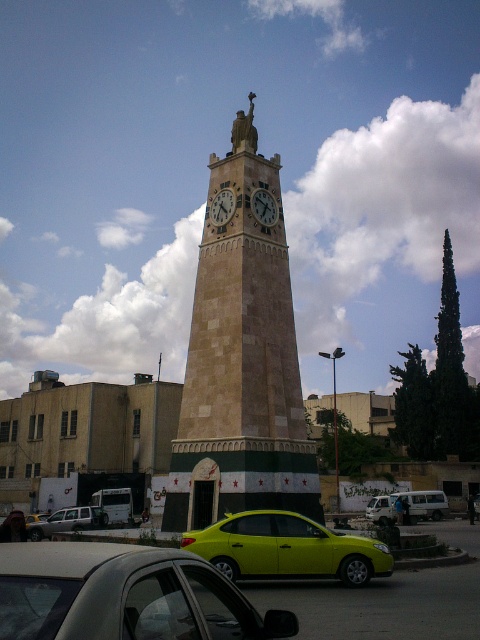
You are standing in the urban area and see the beige stone clock tower at center and the stone clock at center. Which one is closer to you?

The beige stone clock tower at center is closer to you because it is in front of the stone clock at center.

You are driving a metallic silver van at lower left and want to park it next to the beige stone clock tower at center. Can you fit the van alongside the tower without overlapping?

The beige stone clock tower at center is wider than the metallic silver van at lower left, so there is enough space to park the metallic silver van at lower left next to it without overlapping.

You are driving a metallic silver van at lower center and want to park it in a parking spot that can only accommodate vehicles narrower than the wooden clock face at center. Can you safely park your van there?

The metallic silver van at lower center might be wider than the wooden clock face at center, so there is a possibility that it may not fit in the parking spot. It is recommended to check the exact dimensions before attempting to park.